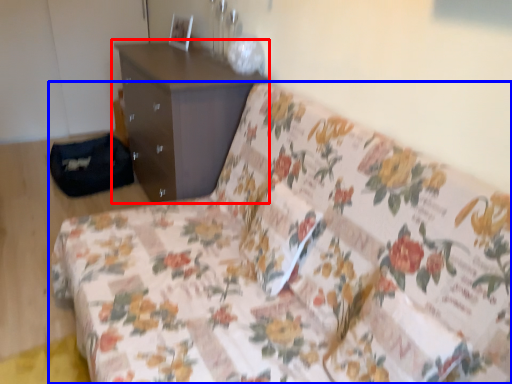
Question: Which point is closer to the camera, chest of drawers (highlighted by a red box) or studio couch (highlighted by a blue box)?

Choices:
 (A) chest of drawers
 (B) studio couch

Answer: (B)